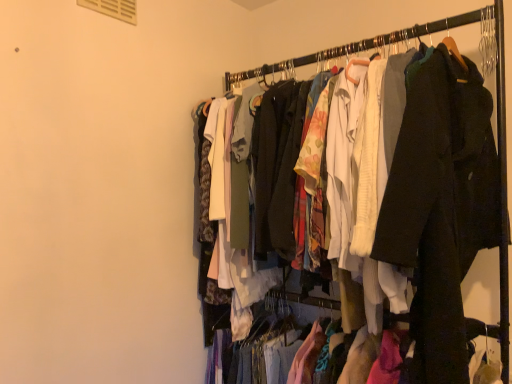
You are a GUI agent. You are given a task and a screenshot of the screen. Output one action in this format:
    pyautogui.click(x=<x>, y=<y>)
    Task: Click on the dark gray pants at center
    The height and width of the screenshot is (384, 512).
    Given the screenshot: What is the action you would take?
    pyautogui.click(x=445, y=194)

The image size is (512, 384). Describe the element at coordinates (445, 194) in the screenshot. I see `dark gray pants at center` at that location.

The width and height of the screenshot is (512, 384). What are the coordinates of `dark gray pants at center` in the screenshot? It's located at (445, 194).